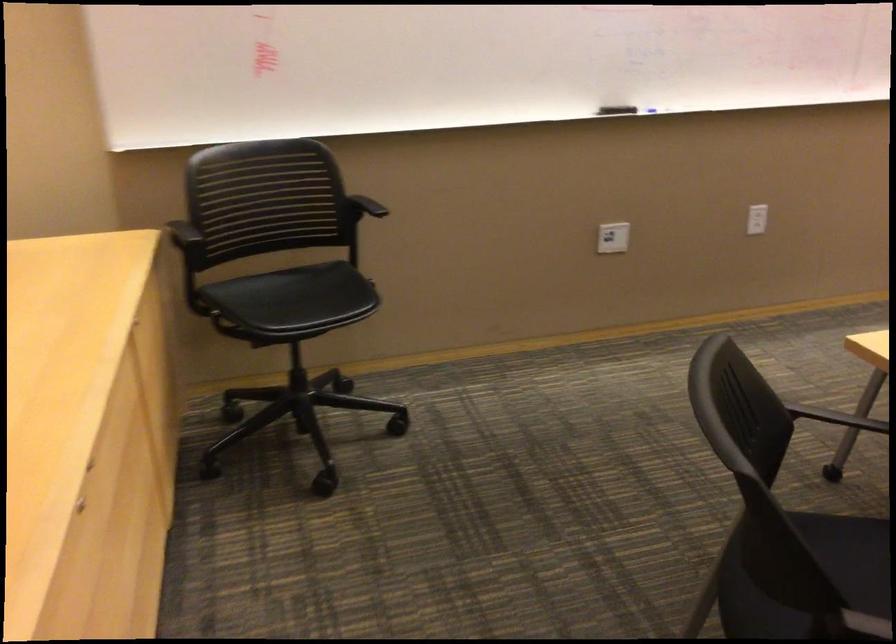
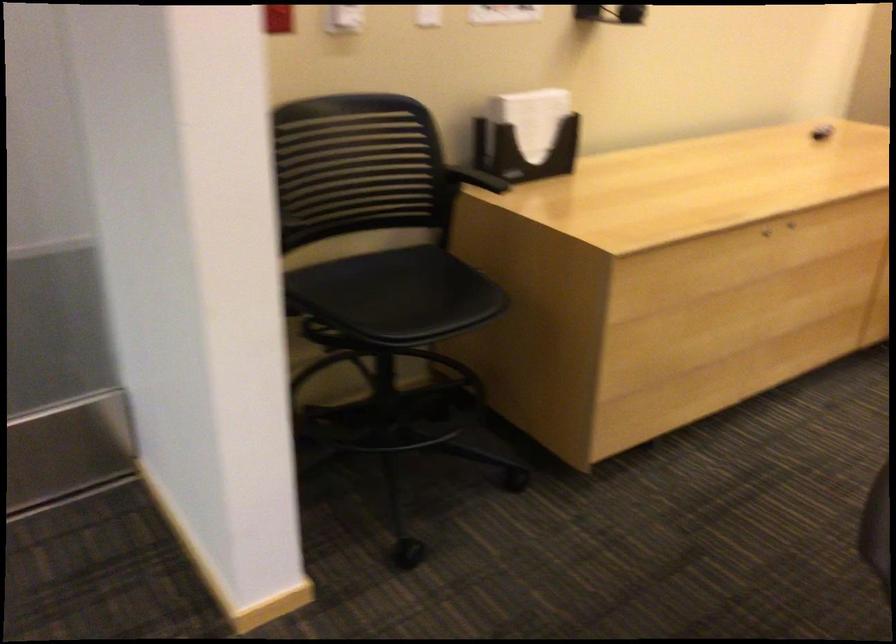
The point at (91, 556) is marked in the first image. Where is the corresponding point in the second image?

(765, 232)